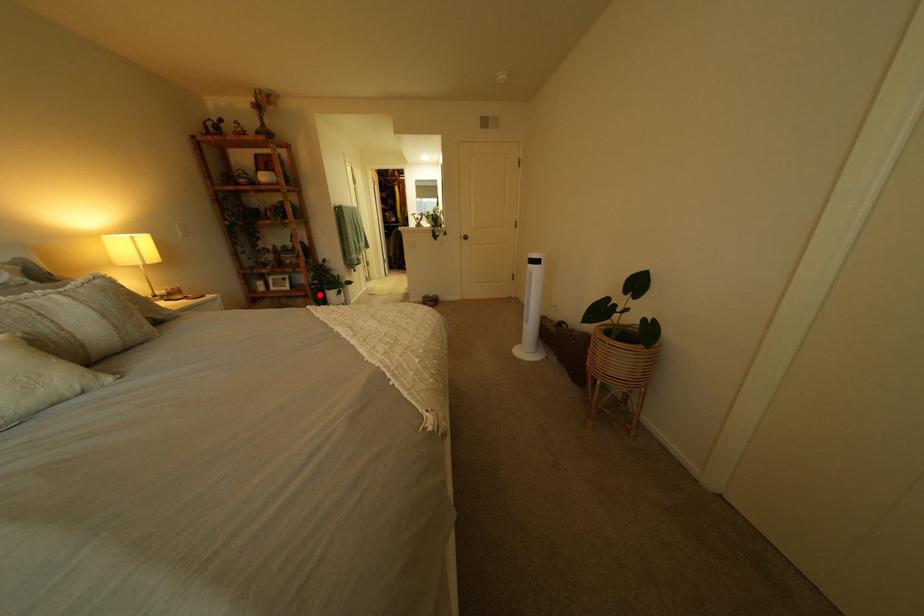
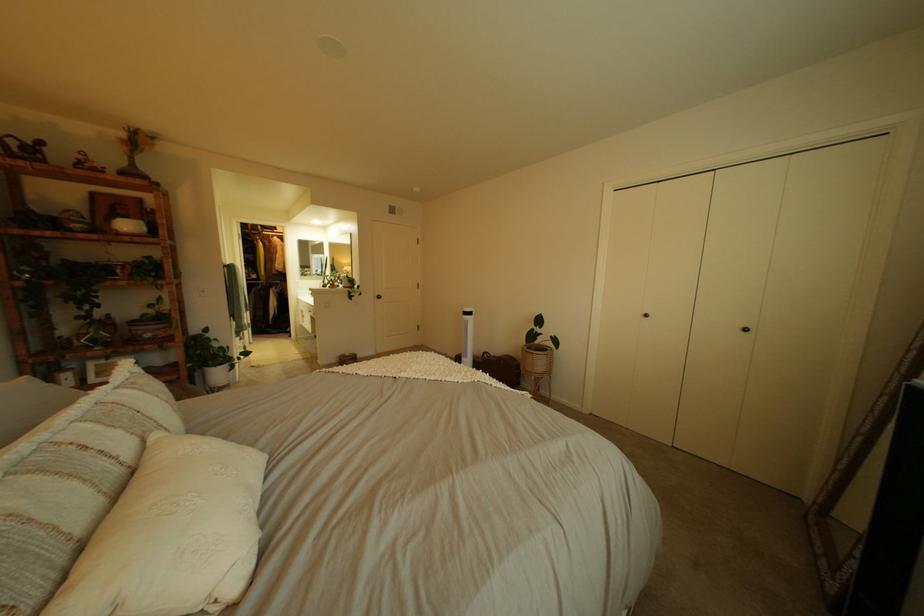
Question: I am providing you with two images of the same scene from different viewpoints. Image1 has a red point marked. In image2, the corresponding 3D location appears at what relative position? Reply with the corresponding letter.

Choices:
 (A) Closer
 (B) Farther

Answer: (B)